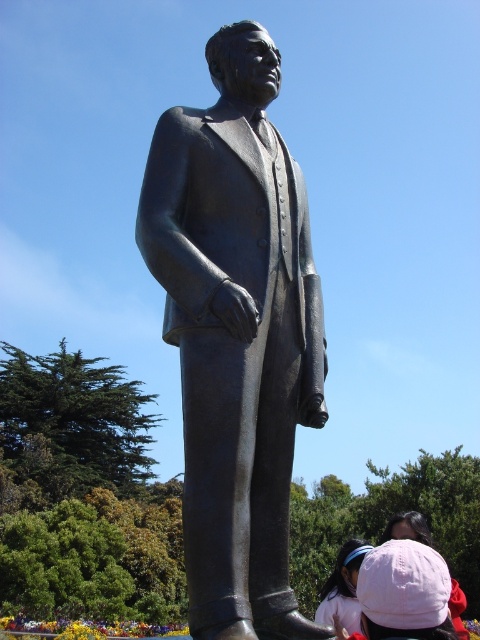
Question: Does bronze statue at center have a larger size compared to pink fabric headband at lower right?

Choices:
 (A) yes
 (B) no

Answer: (B)

Question: Does pink fabric headband at lower right have a lesser width compared to pink fabric hat at lower right?

Choices:
 (A) no
 (B) yes

Answer: (B)

Question: Is bronze statue at center above pink fabric hat at lower right?

Choices:
 (A) no
 (B) yes

Answer: (B)

Question: Which point is farther to the camera?

Choices:
 (A) pink fabric headband at lower right
 (B) bronze statue at center
 (C) pink fabric hat at lower right

Answer: (A)

Question: Which point is closer to the camera taking this photo?

Choices:
 (A) (224, 376)
 (B) (354, 620)
 (C) (466, 604)

Answer: (A)

Question: Which point is closer to the camera?

Choices:
 (A) (407, 532)
 (B) (349, 627)

Answer: (B)